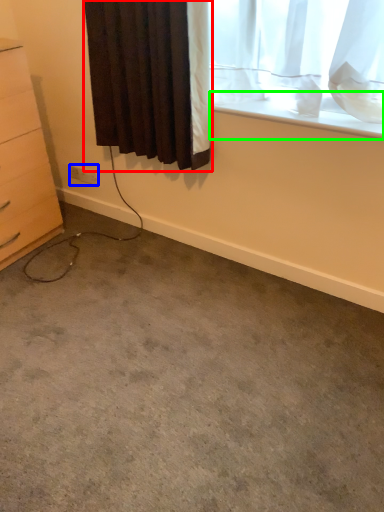
Question: Considering the real-world distances, which object is farthest from curtain (highlighted by a red box)? electric outlet (highlighted by a blue box) or window sill (highlighted by a green box)?

Choices:
 (A) electric outlet
 (B) window sill

Answer: (A)